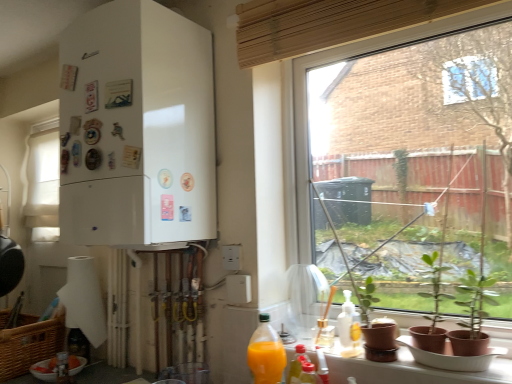
Question: Is translucent plastic bottle at lower left, the 1th bottle positioned from the left, far away from matte brown pots at lower right?

Choices:
 (A) no
 (B) yes

Answer: (B)

Question: Considering the relative sizes of translucent plastic bottle at lower left, which is counted as the 4th bottle, starting from the front, and matte brown pots at lower right in the image provided, is translucent plastic bottle at lower left, which is counted as the 4th bottle, starting from the front, smaller than matte brown pots at lower right?

Choices:
 (A) yes
 (B) no

Answer: (A)

Question: Is translucent plastic bottle at lower left, the first bottle from the back, wider than matte brown pots at lower right?

Choices:
 (A) no
 (B) yes

Answer: (A)

Question: Can you confirm if translucent plastic bottle at lower left, which is counted as the 4th bottle, starting from the front, is positioned to the left of matte brown pots at lower right?

Choices:
 (A) no
 (B) yes

Answer: (B)

Question: Is translucent plastic bottle at lower left, the first bottle from the back, positioned with its back to matte brown pots at lower right?

Choices:
 (A) yes
 (B) no

Answer: (B)

Question: Would you say translucent plastic bottle at lower left, the fourth bottle positioned from the right, contains matte brown pots at lower right?

Choices:
 (A) no
 (B) yes

Answer: (A)

Question: Is matte brown pots at lower right oriented away from green matte plant at lower right?

Choices:
 (A) no
 (B) yes

Answer: (A)

Question: Considering the relative sizes of matte brown pots at lower right and green matte plant at lower right in the image provided, is matte brown pots at lower right shorter than green matte plant at lower right?

Choices:
 (A) yes
 (B) no

Answer: (A)

Question: Is the depth of matte brown pots at lower right greater than that of green matte plant at lower right?

Choices:
 (A) no
 (B) yes

Answer: (A)

Question: Considering the relative sizes of matte brown pots at lower right and green matte plant at lower right in the image provided, is matte brown pots at lower right taller than green matte plant at lower right?

Choices:
 (A) no
 (B) yes

Answer: (A)

Question: Does matte brown pots at lower right have a larger size compared to green matte plant at lower right?

Choices:
 (A) no
 (B) yes

Answer: (A)

Question: Is matte brown pots at lower right at the left side of green matte plant at lower right?

Choices:
 (A) no
 (B) yes

Answer: (A)

Question: Is transparent glass window at center, which is counted as the 1th window, starting from the front, not inside white matte refrigerator at left?

Choices:
 (A) yes
 (B) no

Answer: (A)